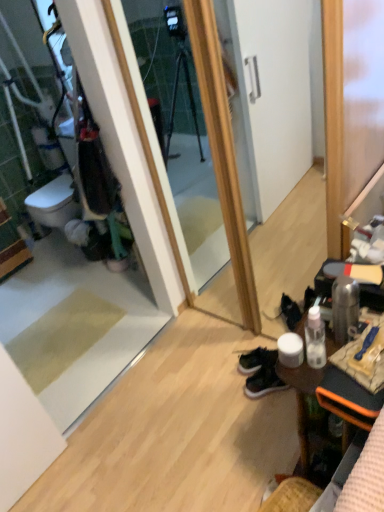
Question: Is dark green suede sneakers at lower right, the 2th footwear viewed from the front, located outside green suede sneakers at lower center, which appears as the first footwear when viewed from the front?

Choices:
 (A) yes
 (B) no

Answer: (A)

Question: From the image's perspective, would you say dark green suede sneakers at lower right, arranged as the first footwear when viewed from the back, is shown under green suede sneakers at lower center, marked as the second footwear in a back-to-front arrangement?

Choices:
 (A) yes
 (B) no

Answer: (B)

Question: Is green suede sneakers at lower center, marked as the second footwear in a back-to-front arrangement, at the back of dark green suede sneakers at lower right, arranged as the first footwear when viewed from the back?

Choices:
 (A) yes
 (B) no

Answer: (B)

Question: Is dark green suede sneakers at lower right, arranged as the first footwear when viewed from the back, smaller than green suede sneakers at lower center, which appears as the first footwear when viewed from the front?

Choices:
 (A) no
 (B) yes

Answer: (A)

Question: Is dark green suede sneakers at lower right, the 2th footwear viewed from the front, oriented towards green suede sneakers at lower center, marked as the second footwear in a back-to-front arrangement?

Choices:
 (A) yes
 (B) no

Answer: (B)

Question: Does dark green suede sneakers at lower right, arranged as the first footwear when viewed from the back, have a larger size compared to green suede sneakers at lower center, marked as the second footwear in a back-to-front arrangement?

Choices:
 (A) no
 (B) yes

Answer: (B)

Question: Is the depth of wooden desk at lower right less than that of green suede sneakers at lower center, which appears as the first footwear when viewed from the front?

Choices:
 (A) yes
 (B) no

Answer: (A)

Question: From the image's perspective, is wooden desk at lower right below green suede sneakers at lower center, which appears as the first footwear when viewed from the front?

Choices:
 (A) no
 (B) yes

Answer: (A)

Question: Considering the relative sizes of wooden desk at lower right and green suede sneakers at lower center, marked as the second footwear in a back-to-front arrangement, in the image provided, is wooden desk at lower right bigger than green suede sneakers at lower center, marked as the second footwear in a back-to-front arrangement,?

Choices:
 (A) no
 (B) yes

Answer: (B)

Question: Is wooden desk at lower right turned away from green suede sneakers at lower center, marked as the second footwear in a back-to-front arrangement?

Choices:
 (A) yes
 (B) no

Answer: (B)

Question: Does wooden desk at lower right have a greater width compared to green suede sneakers at lower center, marked as the second footwear in a back-to-front arrangement?

Choices:
 (A) yes
 (B) no

Answer: (A)

Question: From a real-world perspective, is wooden desk at lower right on green suede sneakers at lower center, which appears as the first footwear when viewed from the front?

Choices:
 (A) yes
 (B) no

Answer: (A)

Question: Could you tell me if wooden desk at lower right is turned towards dark green suede sneakers at lower right, arranged as the first footwear when viewed from the back?

Choices:
 (A) no
 (B) yes

Answer: (B)